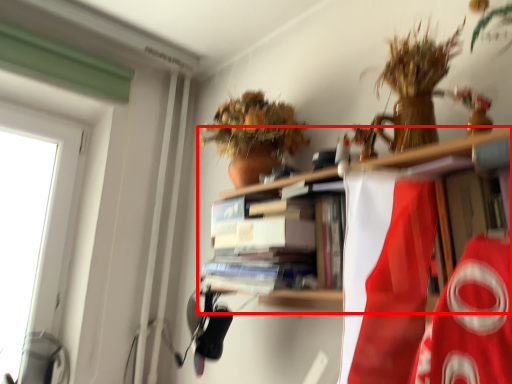
Question: Where is shelf (annotated by the red box) located in relation to book in the image?

Choices:
 (A) left
 (B) right

Answer: (B)